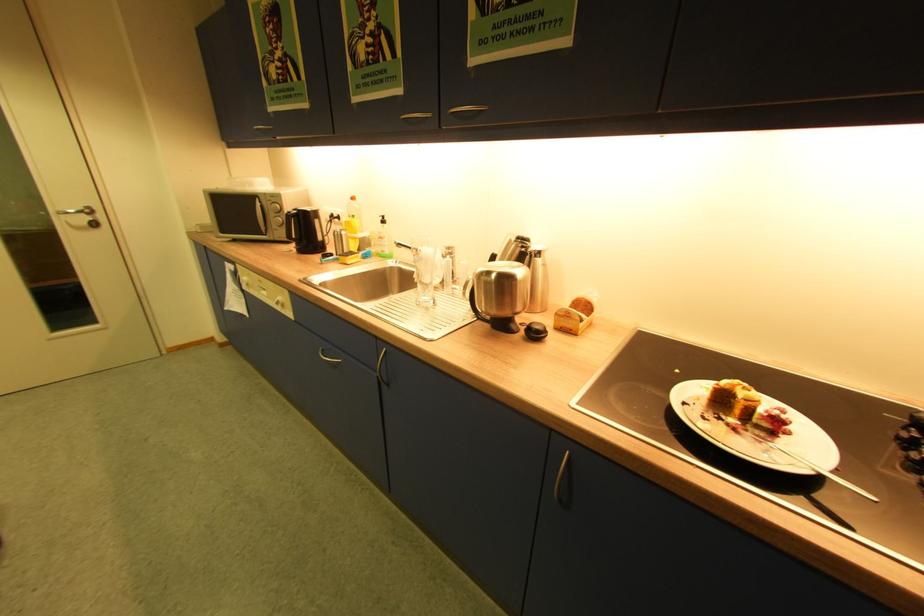
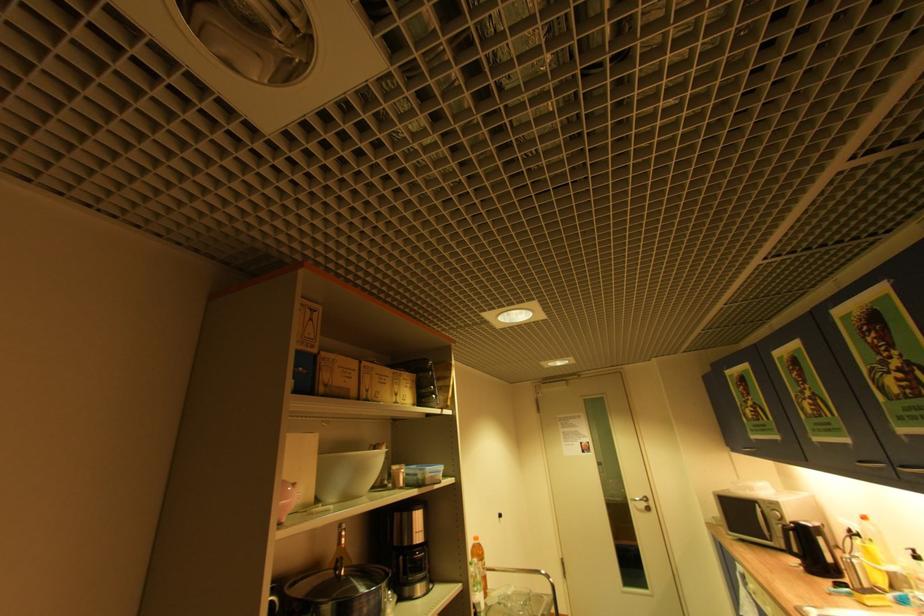
In the second image, find the point that corresponds to point (94, 219) in the first image.

(650, 505)